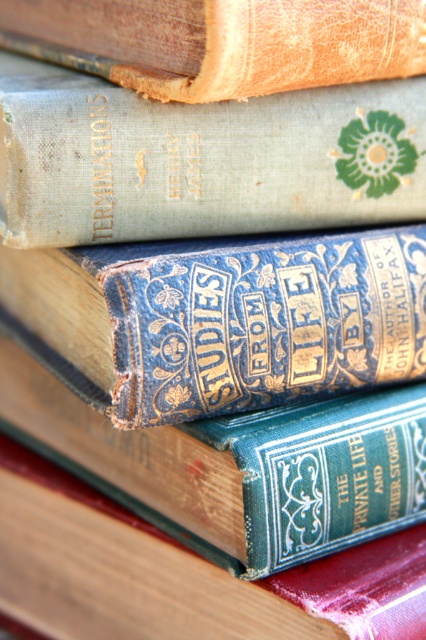
You are a librarian organizing a shelf and need to place a new book between the light green fabric book at upper center and the green leather book at center. Based on their positions, which book should the new book be placed in front of or behind?

The light green fabric book at upper center is closer to the viewer than the green leather book at center, so the new book should be placed behind the light green fabric book at upper center and in front of the green leather book at center to maintain the existing spatial order.

You are organizing a bookshelf and need to place a small decorative item at point coordinates [201,160]. Which book should you place it on?

The point coordinates [201,160] are located on the light green fabric book at upper center, so you should place the decorative item there.

You are organizing a bookshelf and need to place the blue textured book at center and the green leather book at center vertically. Which book should you place on top to ensure stability?

The blue textured book at center is much taller than the green leather book at center, so placing the taller blue textured book at center on the bottom and the shorter green leather book at center on top would provide better stability.